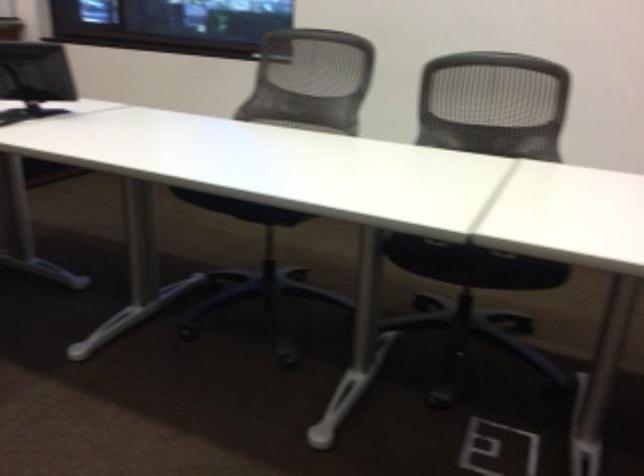
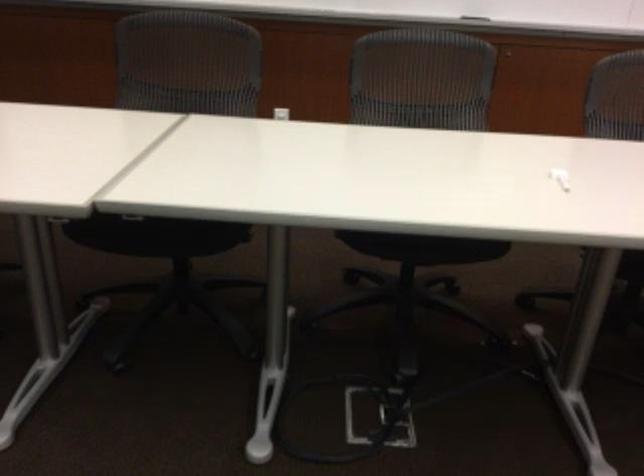
Question: Based on the continuous images, in which direction is the camera rotating? Reply with the corresponding letter.

Choices:
 (A) Left
 (B) Right
 (C) Up
 (D) Down

Answer: (A)